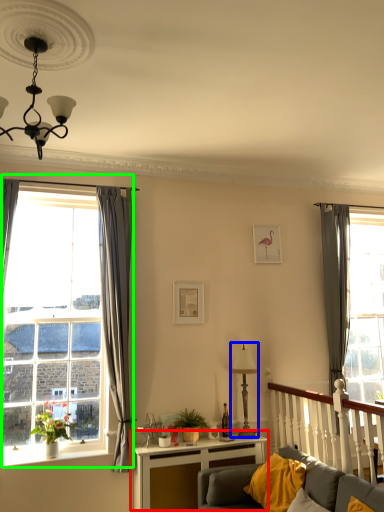
Question: Estimate the real-world distances between objects in this image. Which object is closer to table (highlighted by a red box), lamp (highlighted by a blue box) or window (highlighted by a green box)?

Choices:
 (A) lamp
 (B) window

Answer: (A)